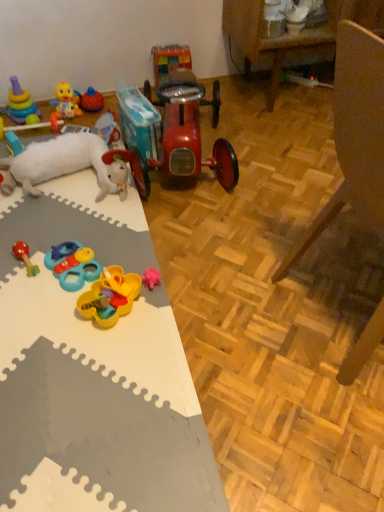
Locate an element on the screen. free space to the back side of plastic/soft yellow and blue toy at lower left, the 4th toy viewed from the right is located at coordinates (91, 228).